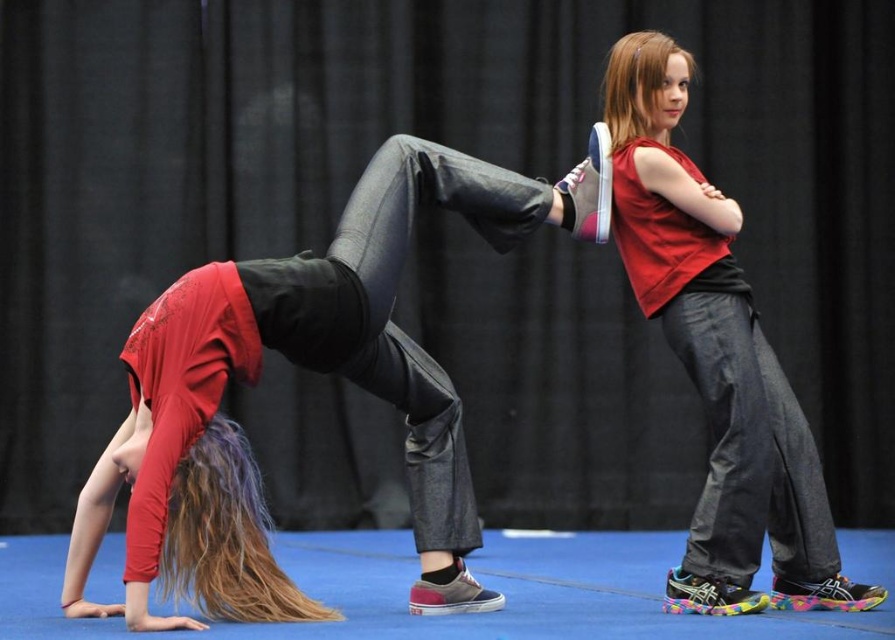
Question: Can you confirm if matte black leggings at center is bigger than matte red tank top at center?

Choices:
 (A) yes
 (B) no

Answer: (A)

Question: Among these objects, which one is farthest from the camera?

Choices:
 (A) matte red tank top at center
 (B) matte black leggings at center

Answer: (A)

Question: Does matte black leggings at center have a lesser width compared to matte red tank top at center?

Choices:
 (A) yes
 (B) no

Answer: (B)

Question: Is matte black leggings at center smaller than matte red tank top at center?

Choices:
 (A) no
 (B) yes

Answer: (A)